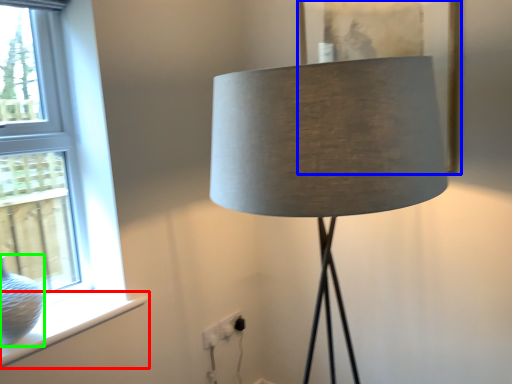
Question: Which is nearer to the window sill (highlighted by a red box)? picture frame (highlighted by a blue box) or glass vase (highlighted by a green box).

Choices:
 (A) picture frame
 (B) glass vase

Answer: (B)